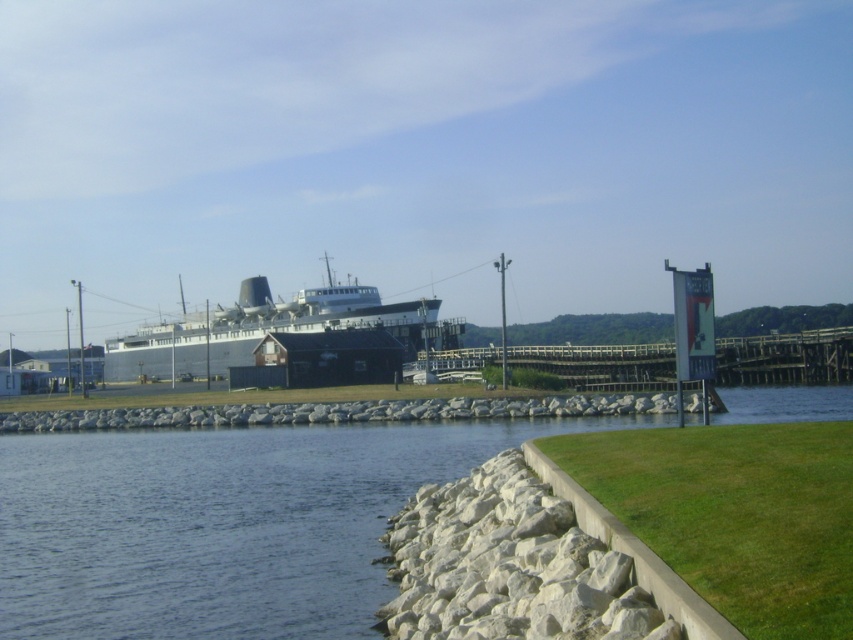
Question: Which object appears farthest from the camera in this image?

Choices:
 (A) clear water at lower left
 (B) gray metallic ship at center

Answer: (B)

Question: Can you confirm if clear water at lower left is positioned to the right of wooden planks at center?

Choices:
 (A) yes
 (B) no

Answer: (B)

Question: Considering the real-world distances, which object is closest to the clear water at lower left?

Choices:
 (A) wooden planks at center
 (B) gray metallic ship at center

Answer: (A)

Question: Can you confirm if clear water at lower left is bigger than wooden planks at center?

Choices:
 (A) no
 (B) yes

Answer: (A)

Question: Which of these objects is positioned farthest from the gray metallic ship at center?

Choices:
 (A) wooden planks at center
 (B) clear water at lower left

Answer: (B)

Question: Is the position of clear water at lower left more distant than that of wooden planks at center?

Choices:
 (A) no
 (B) yes

Answer: (A)